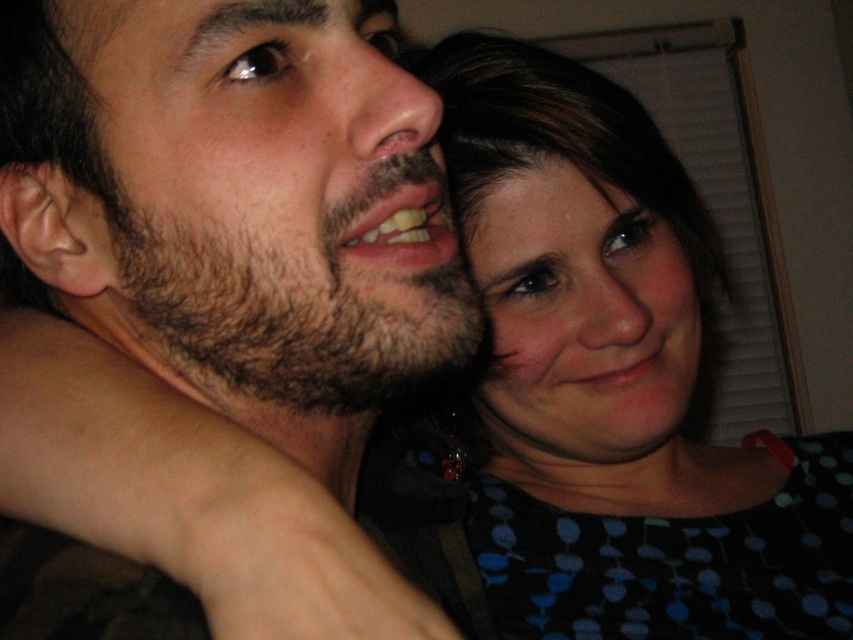
Question: Which object appears closest to the camera in this image?

Choices:
 (A) polka dot fabric at upper right
 (B) matte black hair at upper right

Answer: (A)

Question: Considering the real-world distances, which object is farthest from the matte black hair at upper right?

Choices:
 (A) polka dot fabric at upper right
 (B) dark brown hair at upper left

Answer: (B)

Question: Considering the relative positions of dark brown hair at upper left and matte black hair at upper right in the image provided, where is dark brown hair at upper left located with respect to matte black hair at upper right?

Choices:
 (A) right
 (B) left

Answer: (B)

Question: Does polka dot fabric at upper right appear over dark brown hair at upper left?

Choices:
 (A) yes
 (B) no

Answer: (B)

Question: Which object appears closest to the camera in this image?

Choices:
 (A) dark brown hair at upper left
 (B) polka dot fabric at upper right

Answer: (A)

Question: From the image, what is the correct spatial relationship of polka dot fabric at upper right in relation to matte black hair at upper right?

Choices:
 (A) above
 (B) below

Answer: (B)